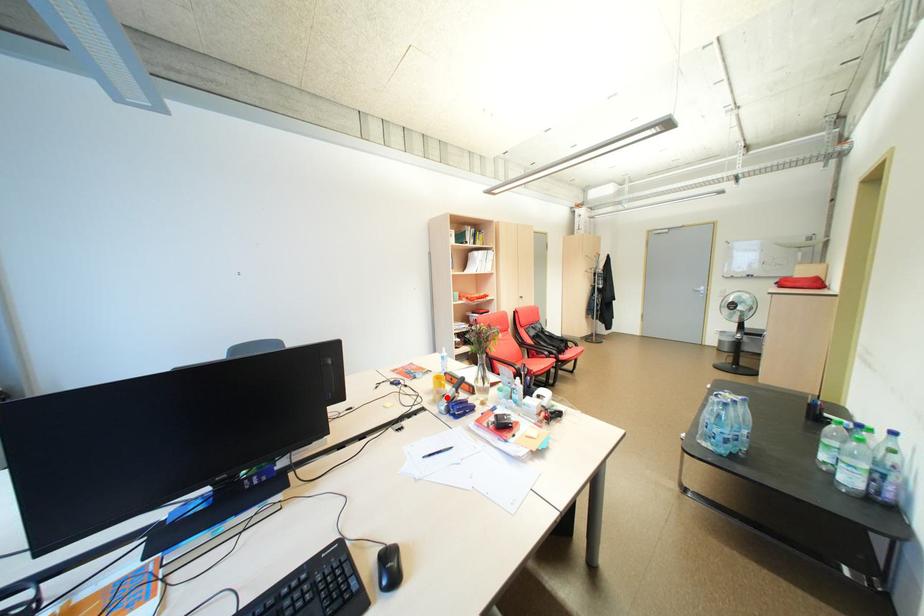
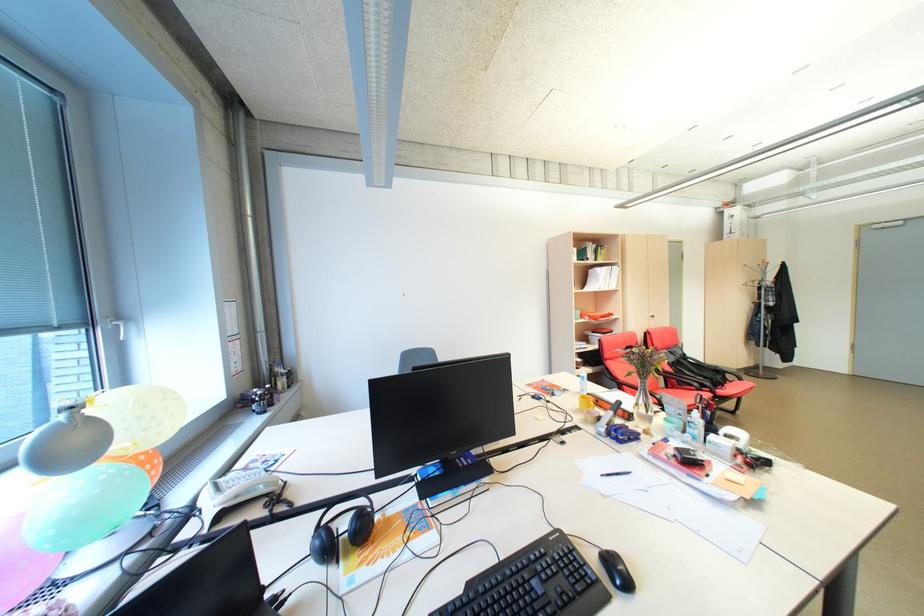
The point at the highlighted location is marked in the first image. Where is the corresponding point in the second image?

(600, 418)